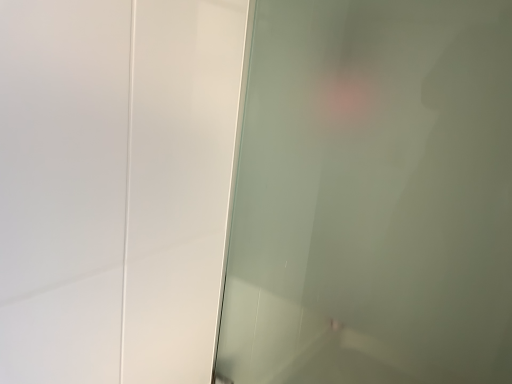
What is the approximate height of frosted glass door at center?

frosted glass door at center is 36.63 inches tall.

This screenshot has height=384, width=512. What do you see at coordinates (373, 196) in the screenshot?
I see `frosted glass door at center` at bounding box center [373, 196].

You are a GUI agent. You are given a task and a screenshot of the screen. Output one action in this format:
    pyautogui.click(x=<x>, y=<y>)
    Task: Click on the frosted glass door at center
    
    Given the screenshot: What is the action you would take?
    pyautogui.click(x=373, y=196)

Find the location of `frosted glass door at center`. frosted glass door at center is located at coordinates (373, 196).